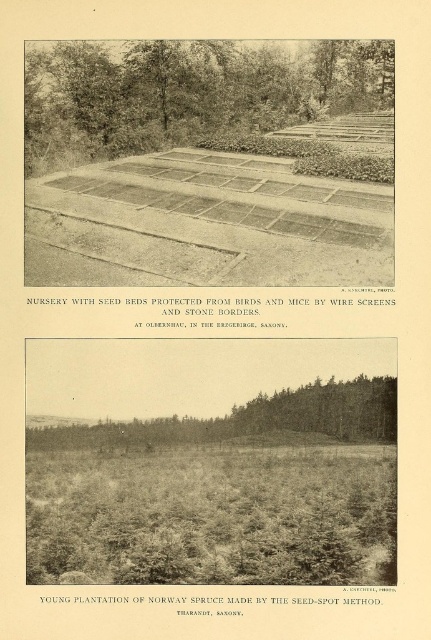
Question: Which of the following is the closest to the observer?

Choices:
 (A) (65, 125)
 (B) (306, 236)

Answer: (B)

Question: Is brown gravel dirt track at center to the right of green leafy tree at upper center from the viewer's perspective?

Choices:
 (A) no
 (B) yes

Answer: (A)

Question: Can you confirm if brown gravel dirt track at center is positioned to the left of green leafy tree at upper center?

Choices:
 (A) no
 (B) yes

Answer: (B)

Question: Which of the following is the farthest from the observer?

Choices:
 (A) brown gravel dirt track at center
 (B) green leafy tree at upper center

Answer: (B)

Question: Observing the image, what is the correct spatial positioning of brown gravel dirt track at center in reference to green leafy tree at upper center?

Choices:
 (A) right
 (B) left

Answer: (B)